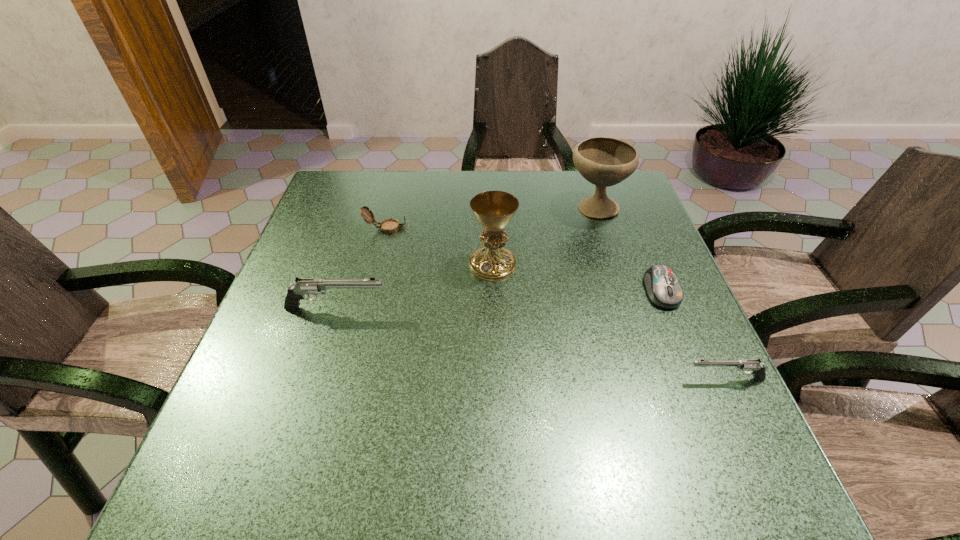
Where is `free point located on the front-facing side of the nearer pistol`? free point located on the front-facing side of the nearer pistol is located at coordinates 628,379.

At what (x,y) coordinates should I click in order to perform the action: click on free space located 0.050m on the front-facing side of the nearer pistol. Please return your answer as a coordinate pair (x, y). This screenshot has height=540, width=960. Looking at the image, I should click on (660, 379).

Locate an element on the screen. free spot located 0.380m on the front-facing side of the nearer pistol is located at coordinates (487, 379).

Locate an element on the screen. The image size is (960, 540). free region located on the back of the right chalice is located at coordinates (586, 179).

Locate an element on the screen. vacant space located 0.310m on the right of the nearer chalice is located at coordinates (644, 265).

Locate an element on the screen. The width and height of the screenshot is (960, 540). free spot located on the face of the compass is located at coordinates (555, 228).

The image size is (960, 540). I want to click on free spot located on the wheel side of the computer mouse, so 683,343.

Where is `object that is positioned at the far edge`? Image resolution: width=960 pixels, height=540 pixels. object that is positioned at the far edge is located at coordinates (602, 161).

You are a GUI agent. You are given a task and a screenshot of the screen. Output one action in this format:
    pyautogui.click(x=<x>, y=<y>)
    Task: Click on the pistol present at the left edge
    Image resolution: width=960 pixels, height=540 pixels.
    Given the screenshot: What is the action you would take?
    pyautogui.click(x=304, y=286)

Find the location of a particular element. Image resolution: width=960 pixels, height=540 pixels. compass at the left edge is located at coordinates (388, 226).